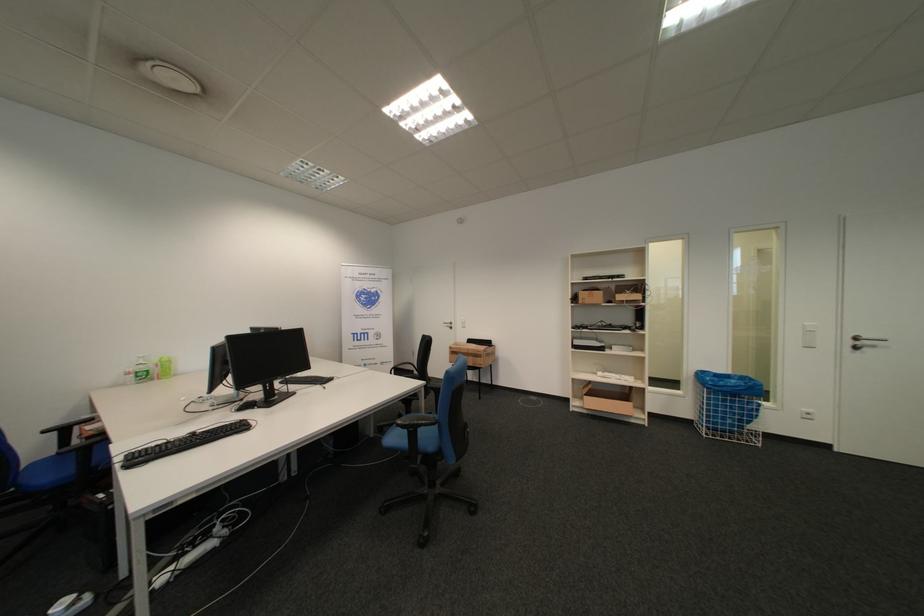
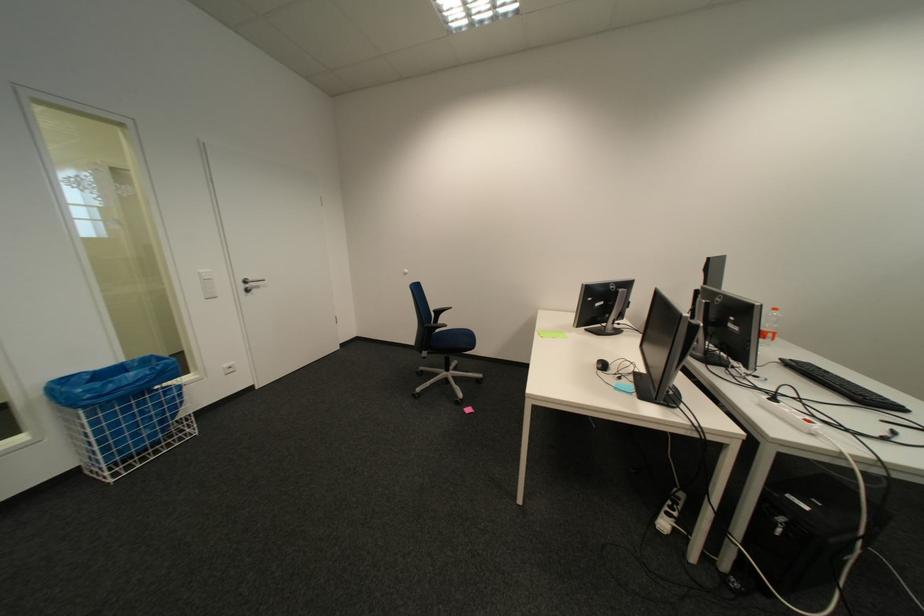
Find the pixel in the second image that matches point 817,326 in the first image.

(212, 275)